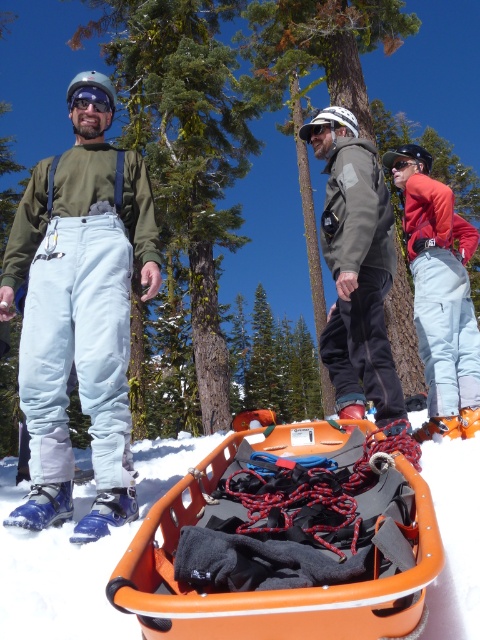
Who is higher up, matte blue ski pants at left or matte gray jacket at center?

matte blue ski pants at left is above.

Who is positioned more to the left, matte blue ski pants at left or matte gray jacket at center?

matte blue ski pants at left

Is point (112, 310) closer to camera compared to point (365, 189)?

Yes, it is.

Image resolution: width=480 pixels, height=640 pixels. In order to click on matte blue ski pants at left in this screenshot , I will do `click(80, 308)`.

Which of these two, matte gray jacket at center or matte orange ski boot at right, stands taller?

With more height is matte orange ski boot at right.

Is matte gray jacket at center thinner than matte orange ski boot at right?

Indeed, matte gray jacket at center has a lesser width compared to matte orange ski boot at right.

Is point (355, 378) in front of point (452, 394)?

Yes.

Find the location of a particular element. This screenshot has width=480, height=640. matte gray jacket at center is located at coordinates (356, 268).

Is blue rubber snowshoe at lower left shorter than blue plastic snowshoe at lower left?

No, blue rubber snowshoe at lower left is not shorter than blue plastic snowshoe at lower left.

Does blue rubber snowshoe at lower left have a lesser width compared to blue plastic snowshoe at lower left?

No, blue rubber snowshoe at lower left is not thinner than blue plastic snowshoe at lower left.

This screenshot has width=480, height=640. What do you see at coordinates (43, 506) in the screenshot?
I see `blue rubber snowshoe at lower left` at bounding box center [43, 506].

Locate an element on the screen. This screenshot has width=480, height=640. blue rubber snowshoe at lower left is located at coordinates (43, 506).